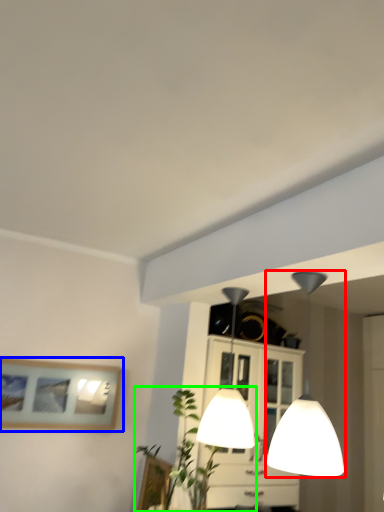
Question: Considering the real-world distances, which object is closest to lamp (highlighted by a red box)? picture frame (highlighted by a blue box) or plant (highlighted by a green box).

Choices:
 (A) picture frame
 (B) plant

Answer: (B)